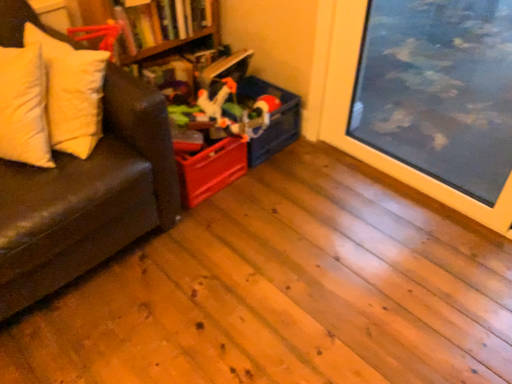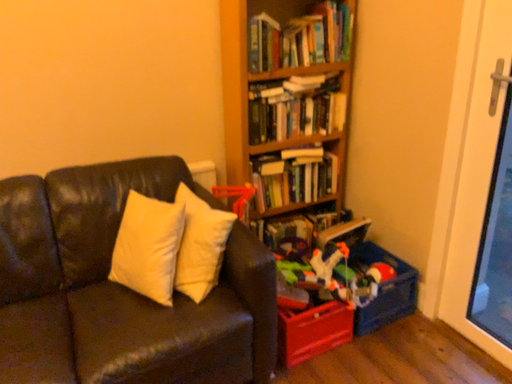
Question: Which way did the camera rotate in the video?

Choices:
 (A) rotated downward
 (B) rotated upward

Answer: (B)